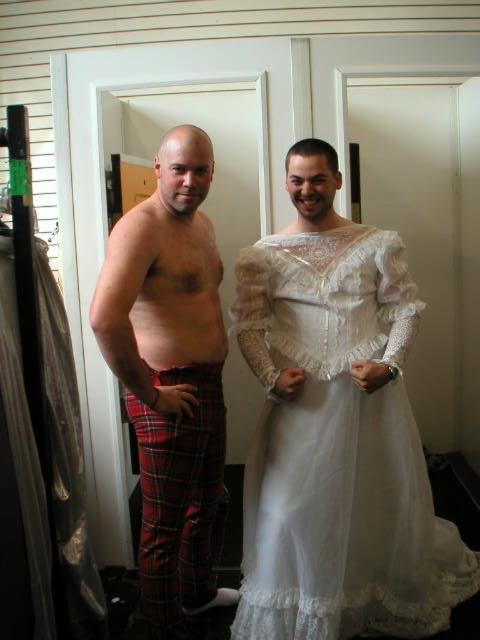
You are helping someone organize their closet. You see the plaid cotton pants at left and the red plaid pants at left. Which pair is closer to the floor?

The plaid cotton pants at left are closer to the floor because they are positioned under the red plaid pants at left.

You are a fashion designer observing the two individuals in the dressing room. You need to determine which plaid cotton garment is positioned higher on the body between the plaid cotton pants at left and the plaid cotton kilt at lower left. Which one is higher?

The plaid cotton pants at left is positioned higher on the body than the plaid cotton kilt at lower left, as it is described to be above it.